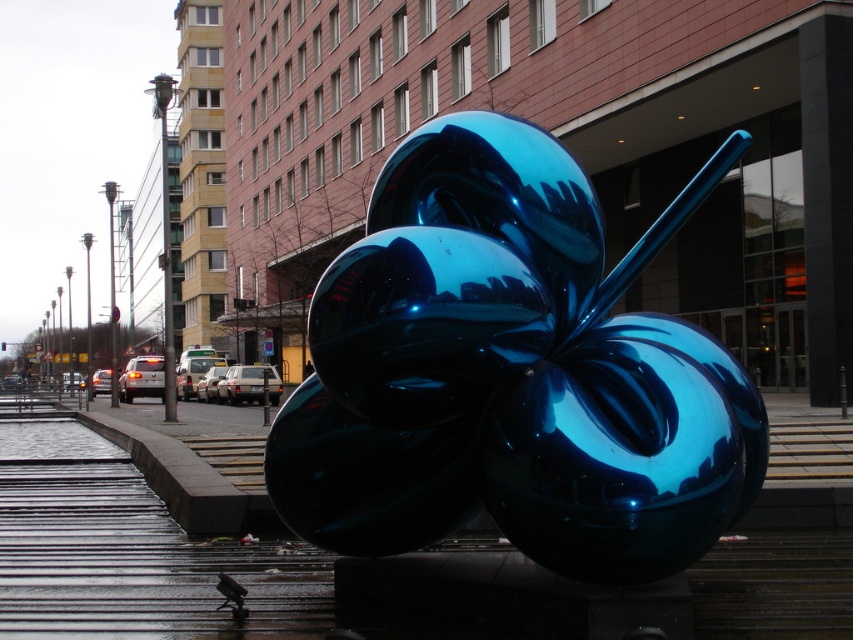
Who is more forward, (665,545) or (183,568)?

Positioned in front is point (665,545).

Can you confirm if glossy metallic sculpture at center is smaller than glossy concrete pavement at center?

Indeed, glossy metallic sculpture at center has a smaller size compared to glossy concrete pavement at center.

You are a GUI agent. You are given a task and a screenshot of the screen. Output one action in this format:
    pyautogui.click(x=<x>, y=<y>)
    Task: Click on the glossy metallic sculpture at center
    This screenshot has height=640, width=853.
    Given the screenshot: What is the action you would take?
    pyautogui.click(x=512, y=372)